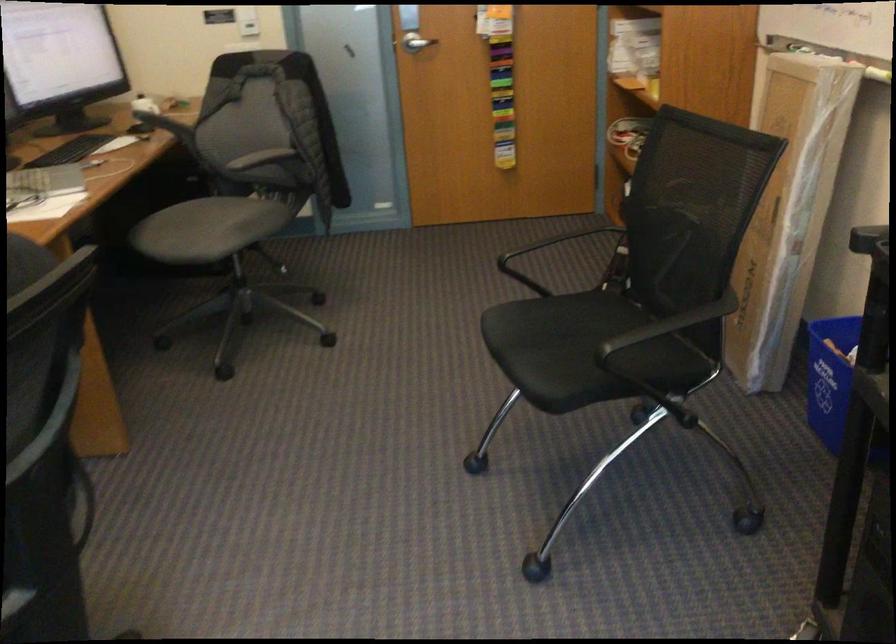
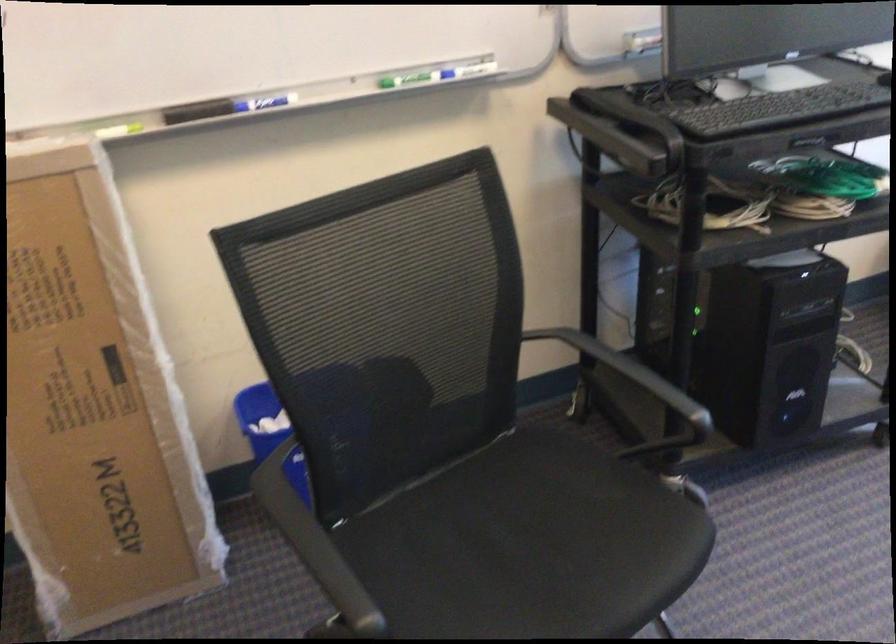
Locate, in the second image, the point that corresponds to (x=582, y=371) in the first image.

(530, 545)